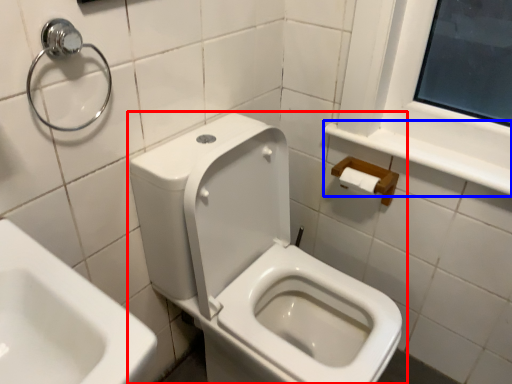
Question: Which point is closer to the camera, toilet (highlighted by a red box) or balustrade (highlighted by a blue box)?

Choices:
 (A) toilet
 (B) balustrade

Answer: (A)